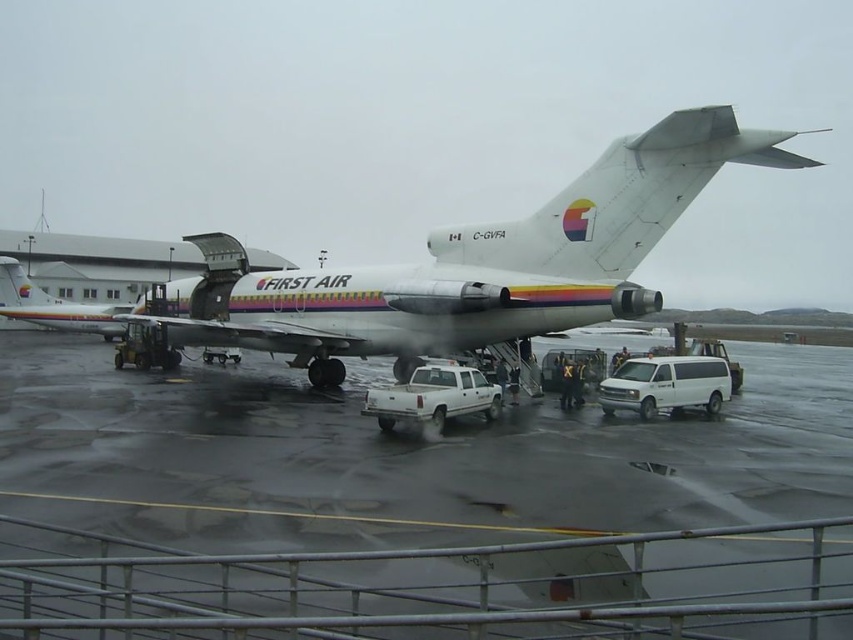
Question: Among these objects, which one is farthest from the camera?

Choices:
 (A) matte white airplane at left
 (B) white matte truck at center
 (C) shiny asphalt tarmac at center

Answer: (A)

Question: Which point appears farthest from the camera in this image?

Choices:
 (A) (10, 420)
 (B) (450, 412)
 (C) (90, 314)
 (D) (228, 308)

Answer: (C)

Question: Which point is closer to the camera?

Choices:
 (A) shiny asphalt tarmac at center
 (B) white matte van at lower right

Answer: (A)

Question: Does white matte airplane at center have a lesser width compared to white matte van at lower right?

Choices:
 (A) no
 (B) yes

Answer: (A)

Question: Can you confirm if shiny asphalt tarmac at center is smaller than matte white airplane at left?

Choices:
 (A) no
 (B) yes

Answer: (B)

Question: Does white matte truck at center appear over matte white airplane at left?

Choices:
 (A) yes
 (B) no

Answer: (B)